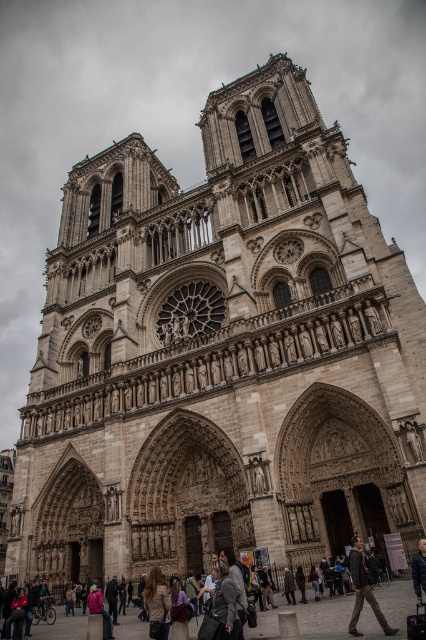
You are a photographer standing in front of Notre Dame Cathedral and you see a dark gray fabric jacket at lower right and a dark blue leather jacket at center. Which jacket is wider?

The dark gray fabric jacket at lower right might be wider than the dark blue leather jacket at center.

You are standing in front of the Notre Dame Cathedral and see two jackets. The dark gray fabric jacket at lower right and the dark blue leather jacket at center. Which jacket is larger in size?

The dark gray fabric jacket at lower right is bigger than the dark blue leather jacket at center.

You are a tourist standing in front of Notre Dame Cathedral and you see two jackets. One is a dark gray fabric jacket at lower right and the other is a dark blue leather jacket at center. Which jacket is shorter in height?

The dark gray fabric jacket at lower right has a lesser height compared to the dark blue leather jacket at center, so the dark gray fabric jacket at lower right is shorter in height.